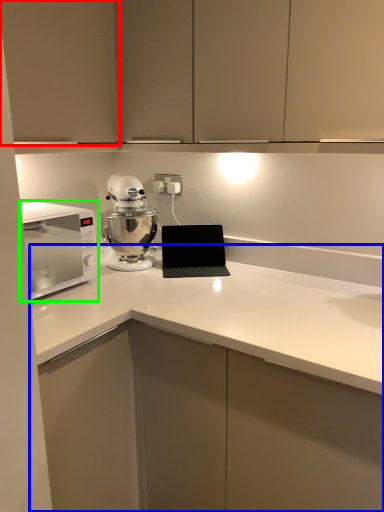
Question: Estimate the real-world distances between objects in this image. Which object is farther from cabinetry (highlighted by a red box), countertop (highlighted by a blue box) or home appliance (highlighted by a green box)?

Choices:
 (A) countertop
 (B) home appliance

Answer: (A)